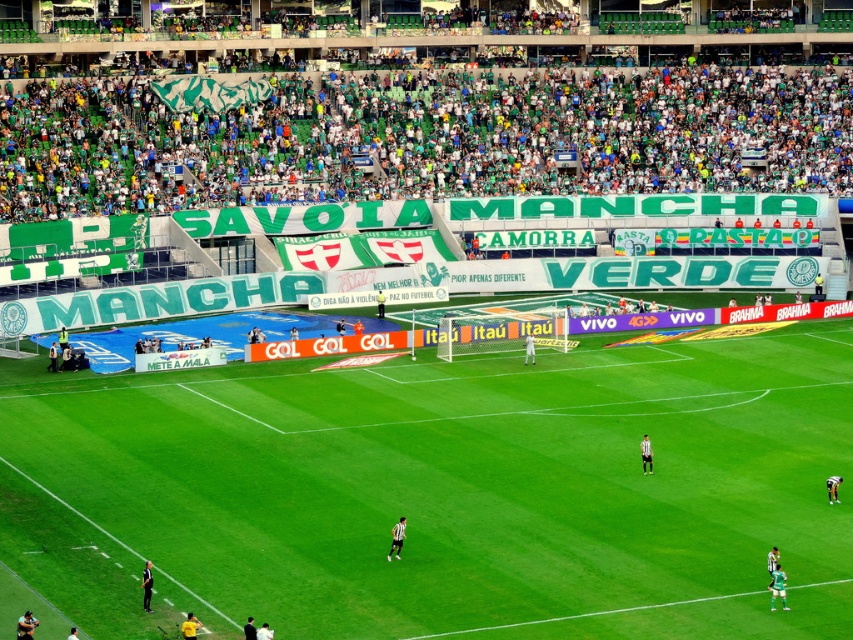
Question: Does black leather jacket at lower left appear on the left side of dark green jersey at center?

Choices:
 (A) yes
 (B) no

Answer: (A)

Question: Among these objects, which one is farthest from the camera?

Choices:
 (A) dark green jersey at center
 (B) black uniformed person at lower left
 (C) green matte jersey at lower right
 (D) striped jersey person at center

Answer: (D)

Question: Is striped jersey person at center wider than dark green jersey at center?

Choices:
 (A) yes
 (B) no

Answer: (B)

Question: Which of these objects is positioned closest to the yellow jersey at lower left?

Choices:
 (A) striped jersey person at center
 (B) white shirt at center
 (C) black leather jacket at lower left

Answer: (B)

Question: Which point is farther to the camera?

Choices:
 (A) (647, 452)
 (B) (244, 625)
 (C) (393, 550)

Answer: (A)

Question: Is green grass football field at center positioned at the back of black uniformed person at center?

Choices:
 (A) no
 (B) yes

Answer: (A)